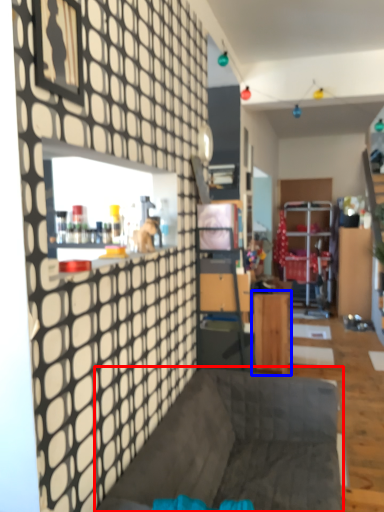
Question: Which point is closer to the camera, furniture (highlighted by a red box) or table (highlighted by a blue box)?

Choices:
 (A) furniture
 (B) table

Answer: (A)